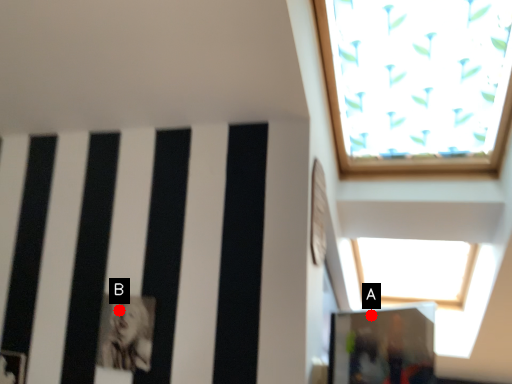
Question: Two points are circled on the image, labeled by A and B beside each circle. Which point is closer to the camera taking this photo?

Choices:
 (A) A is closer
 (B) B is closer

Answer: (B)